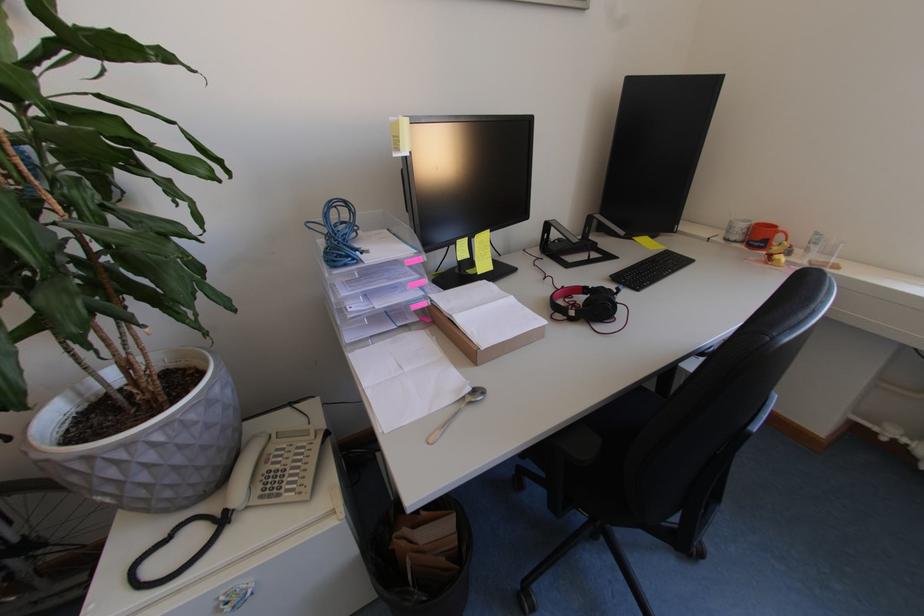
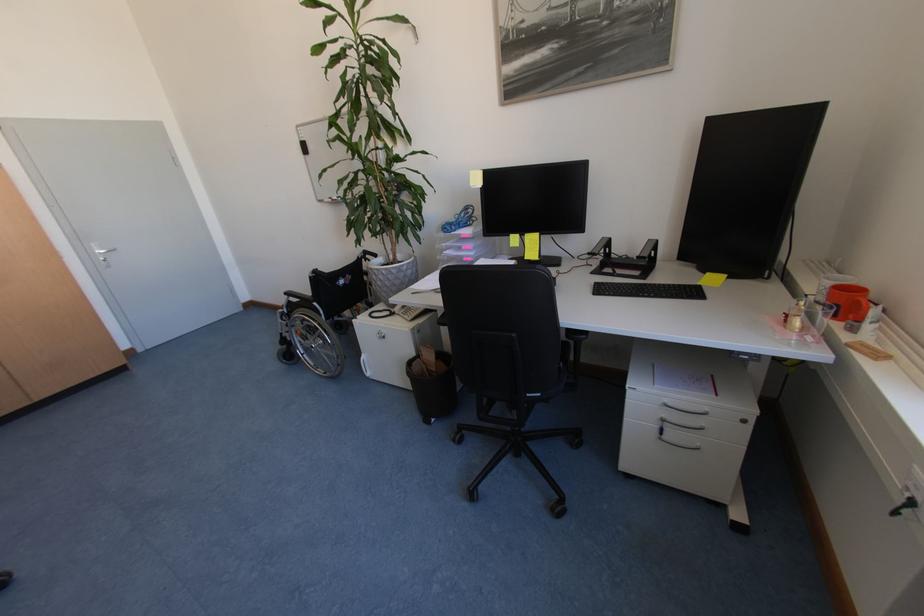
The point at (507, 256) is marked in the first image. Where is the corresponding point in the second image?

(581, 259)